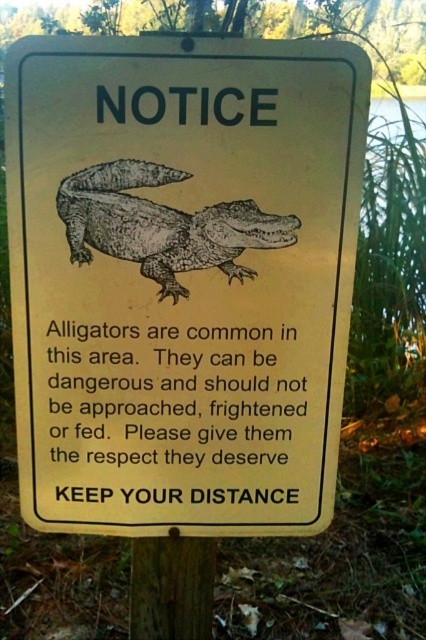
Who is shorter, yellow paper sign at center or brown wood pole at center?

Standing shorter between the two is brown wood pole at center.

Can you confirm if yellow paper sign at center is thinner than brown wood pole at center?

No.

What do you see at coordinates (181, 278) in the screenshot? The height and width of the screenshot is (640, 426). I see `yellow paper sign at center` at bounding box center [181, 278].

Where is `yellow paper sign at center`? yellow paper sign at center is located at coordinates coord(181,278).

Is yellow paper sign at center above brown textured alligator at center?

No, yellow paper sign at center is not above brown textured alligator at center.

Can you confirm if yellow paper sign at center is bigger than brown textured alligator at center?

Yes, yellow paper sign at center is bigger than brown textured alligator at center.

Does point (172, 394) come behind point (132, 220)?

Yes, it is.

The height and width of the screenshot is (640, 426). Identify the location of yellow paper sign at center. (181, 278).

Who is more forward, (78, 221) or (203, 579)?

Point (78, 221)

Which is above, brown textured alligator at center or brown wood pole at center?

brown textured alligator at center is above.

The height and width of the screenshot is (640, 426). What do you see at coordinates (161, 225) in the screenshot?
I see `brown textured alligator at center` at bounding box center [161, 225].

Where is `brown textured alligator at center`? brown textured alligator at center is located at coordinates (161, 225).